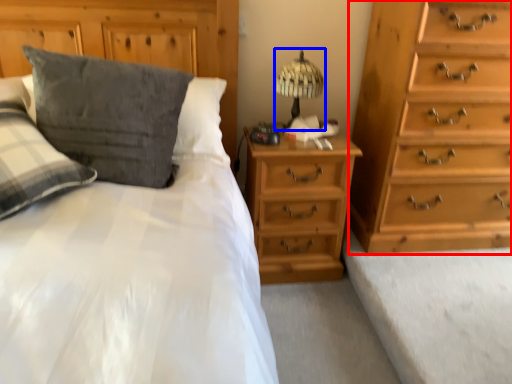
Question: Which of the following is the closest to the observer, chest of drawers (highlighted by a red box) or table lamp (highlighted by a blue box)?

Choices:
 (A) chest of drawers
 (B) table lamp

Answer: (A)